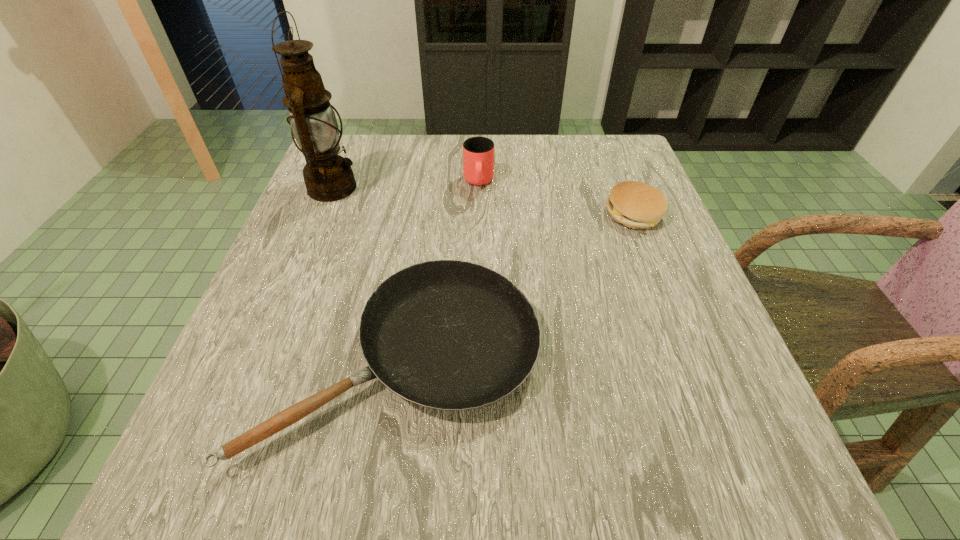
I want to click on free spot between the nearest object and the patty, so (517, 287).

Find the location of a particular element. This screenshot has height=540, width=960. free spot between the patty and the cup is located at coordinates (556, 198).

Identify which object is the nearest to the cup. Please provide its 2D coordinates. Your answer should be formatted as a tuple, i.e. [(x, y)], where the tuple contains the x and y coordinates of a point satisfying the conditions above.

[(635, 204)]

Find the location of a particular element. object that is the nearest to the second tallest object is located at coordinates (635, 204).

Locate an element on the screen. This screenshot has width=960, height=540. free region that satisfies the following two spatial constraints: 1. on the handle side of the third shortest object; 2. on the left side of the rightmost object is located at coordinates point(479,214).

The height and width of the screenshot is (540, 960). Find the location of `vacant region that satisfies the following two spatial constraints: 1. on the back side of the rightmost object; 2. on the left side of the frying pan`. vacant region that satisfies the following two spatial constraints: 1. on the back side of the rightmost object; 2. on the left side of the frying pan is located at coordinates (422, 214).